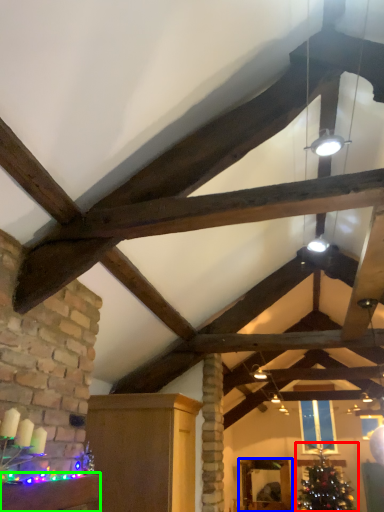
Question: Which object is positioned closest to christmas tree (highlighted by a red box)? Select from furniture (highlighted by a blue box) and furniture (highlighted by a green box).

Choices:
 (A) furniture
 (B) furniture

Answer: (A)